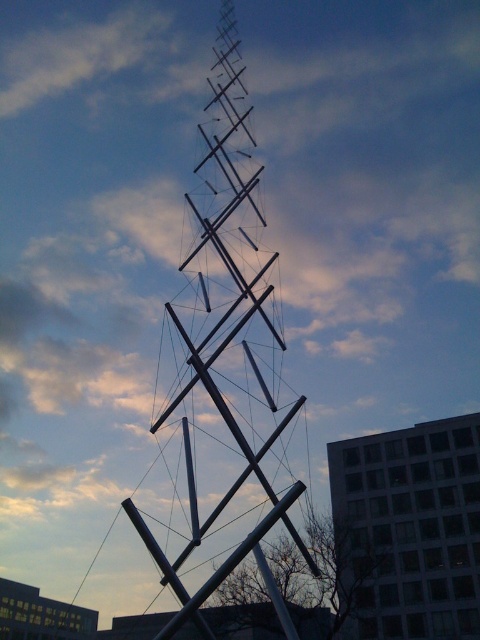
Based on the scene description, which object is wider between the silver metallic spire at center and the white glass building at center?

The silver metallic spire at center is wider than the white glass building at center according to the description.

You are an architect evaluating the sculpture and building in the image. Given that the silver metallic spire at center is part of the sculpture and the white glass building at center is a nearby structure, which one has a greater height?

The silver metallic spire at center is taller than the white glass building at center according to the description.

What are the coordinates of the silver metallic spire at center?

The silver metallic spire at center is located at coordinates point (223, 371).